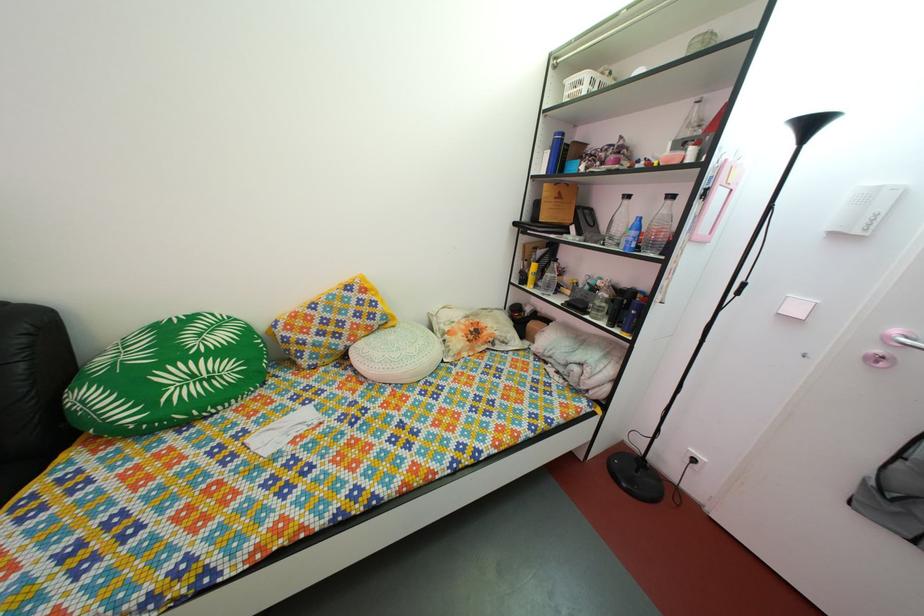
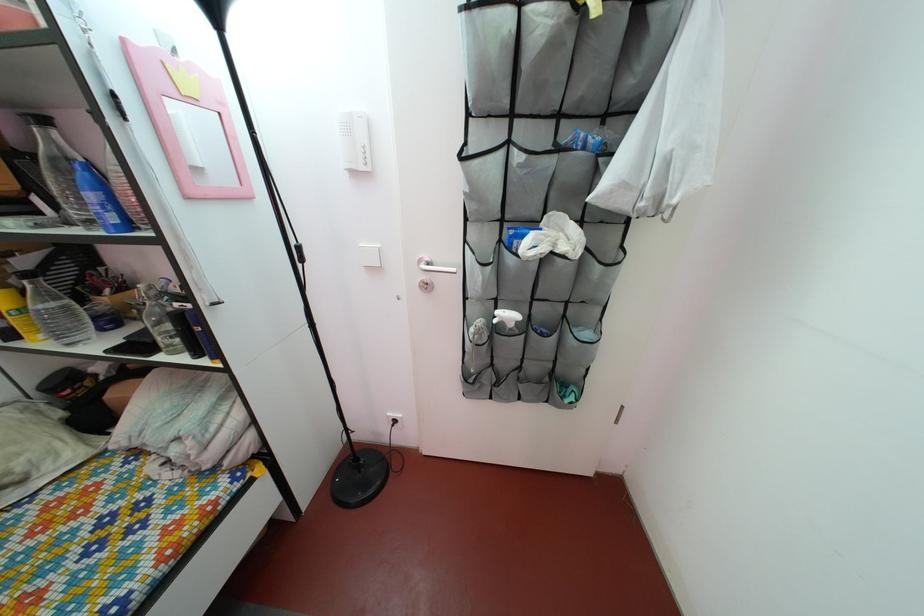
In the second image, find the point that corresponds to (x=588, y=241) in the first image.

(68, 217)